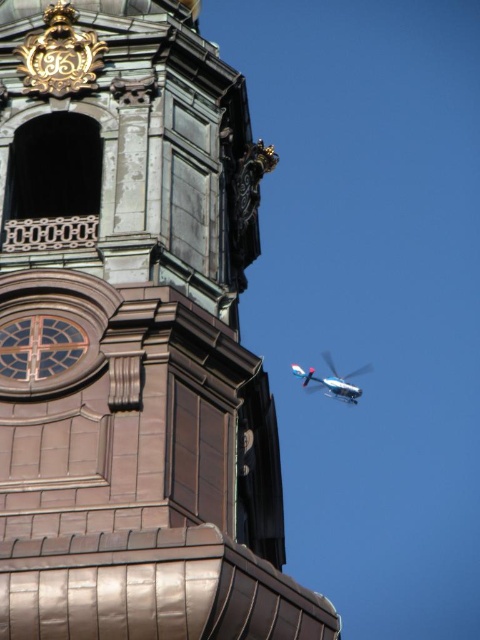
Does point (15, 461) come in front of point (317, 378)?

Yes, it is in front of point (317, 378).

Can you confirm if brown stone tower at center is bigger than metallic silver helicopter at upper right?

Yes.

You are a GUI agent. You are given a task and a screenshot of the screen. Output one action in this format:
    pyautogui.click(x=<x>, y=<y>)
    Task: Click on the brown stone tower at center
    The width and height of the screenshot is (480, 640).
    Given the screenshot: What is the action you would take?
    pyautogui.click(x=132, y=339)